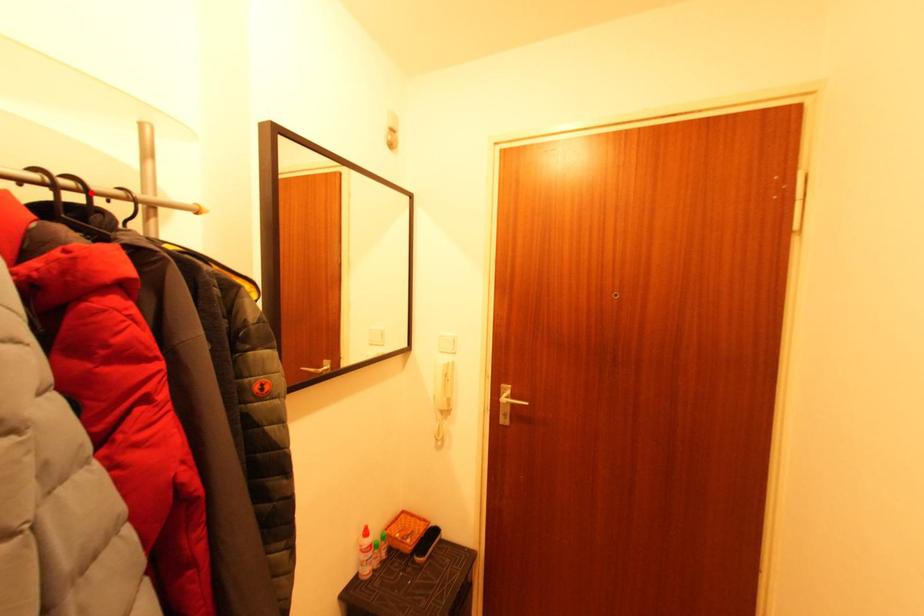
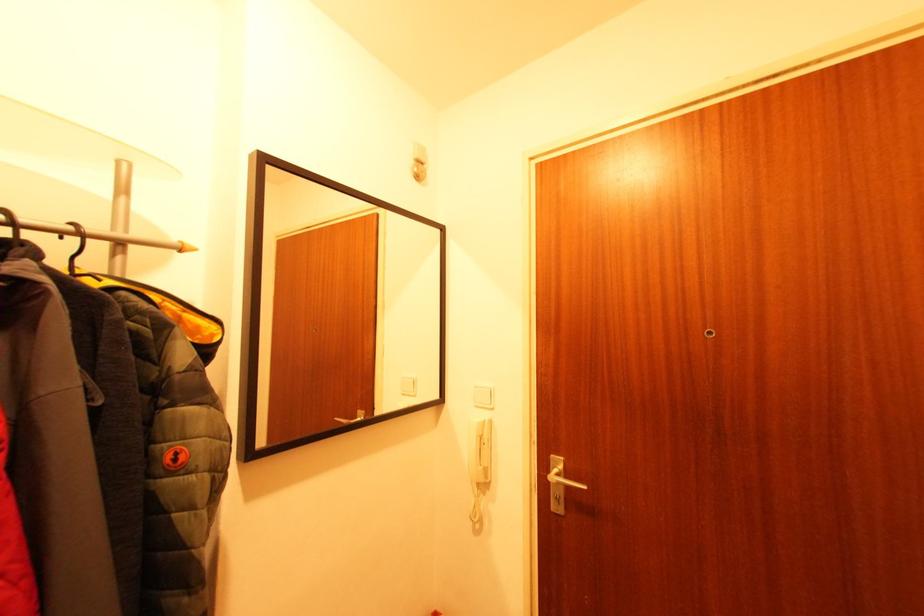
Find the pixel in the second image that matches the highlighted location in the first image.

(19, 225)